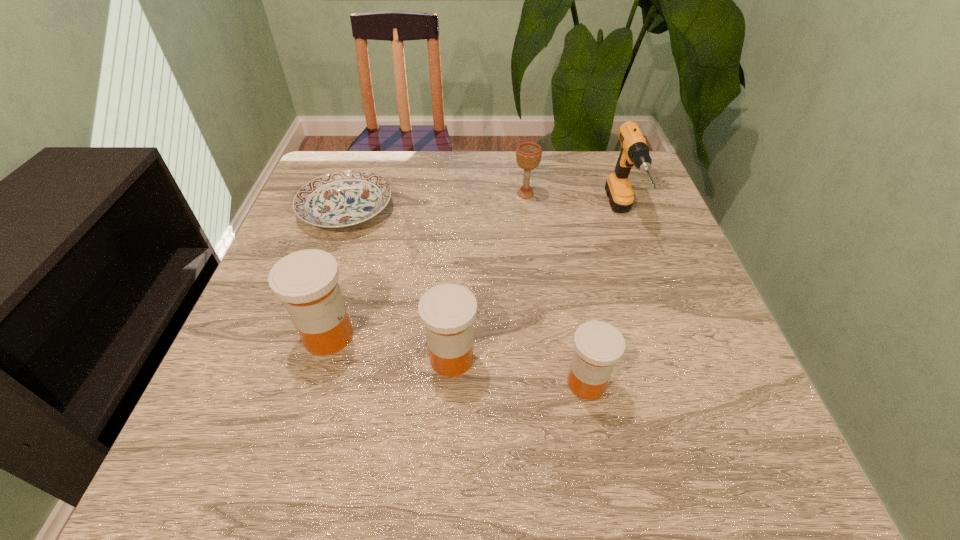
This screenshot has width=960, height=540. I want to click on vacant area that lies between the second medicine from left to right and the chalice, so click(x=489, y=276).

This screenshot has width=960, height=540. I want to click on empty space between the rightmost medicine and the second medicine from left to right, so click(519, 370).

This screenshot has height=540, width=960. What are the coordinates of `vacant space that is in between the shortest object and the drill` in the screenshot? It's located at (484, 213).

Where is `vacant area between the chalice and the leftmost medicine`? The image size is (960, 540). vacant area between the chalice and the leftmost medicine is located at coordinates (427, 265).

The height and width of the screenshot is (540, 960). Identify the location of vacant space that's between the second medicine from left to right and the chalice. (489, 276).

Identify the location of object that ranks as the closest to the third object from left to right. The image size is (960, 540). (306, 281).

You are a GUI agent. You are given a task and a screenshot of the screen. Output one action in this format:
    pyautogui.click(x=<x>, y=<y>)
    Task: Click on the object that is the third closest to the leftmost medicine
    The image size is (960, 540).
    Given the screenshot: What is the action you would take?
    pyautogui.click(x=598, y=345)

Identify which medicine is located as the third nearest to the drill. Please provide its 2D coordinates. Your answer should be formatted as a tuple, i.e. [(x, y)], where the tuple contains the x and y coordinates of a point satisfying the conditions above.

[(306, 281)]

Where is `the closest medicine to the fourth object from right to left`? the closest medicine to the fourth object from right to left is located at coordinates (306, 281).

At what (x,y) coordinates should I click in order to perform the action: click on free space that satisfies the following two spatial constraints: 1. at the tip of the rightmost object; 2. on the label of the leftmost medicine. Please return your answer as a coordinate pair (x, y). The image size is (960, 540). Looking at the image, I should click on (665, 336).